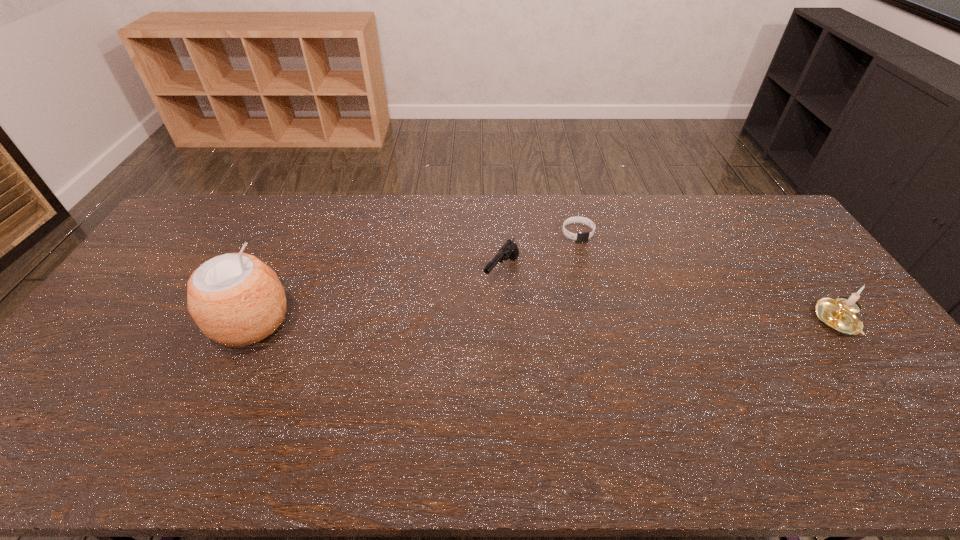
The image size is (960, 540). Identify the location of vacant space in between the shortest object and the rightmost object. (708, 277).

Where is `free spot between the leftmost object and the wristband`? free spot between the leftmost object and the wristband is located at coordinates (415, 278).

What are the coordinates of `free space between the candle holder and the third object from right to left` in the screenshot? It's located at pyautogui.click(x=670, y=297).

At what (x,y) coordinates should I click in order to perform the action: click on object that stands as the second closest to the rightmost object. Please return your answer as a coordinate pair (x, y). The height and width of the screenshot is (540, 960). Looking at the image, I should click on (509, 250).

I want to click on object that is the third closest one to the gun, so pyautogui.click(x=839, y=315).